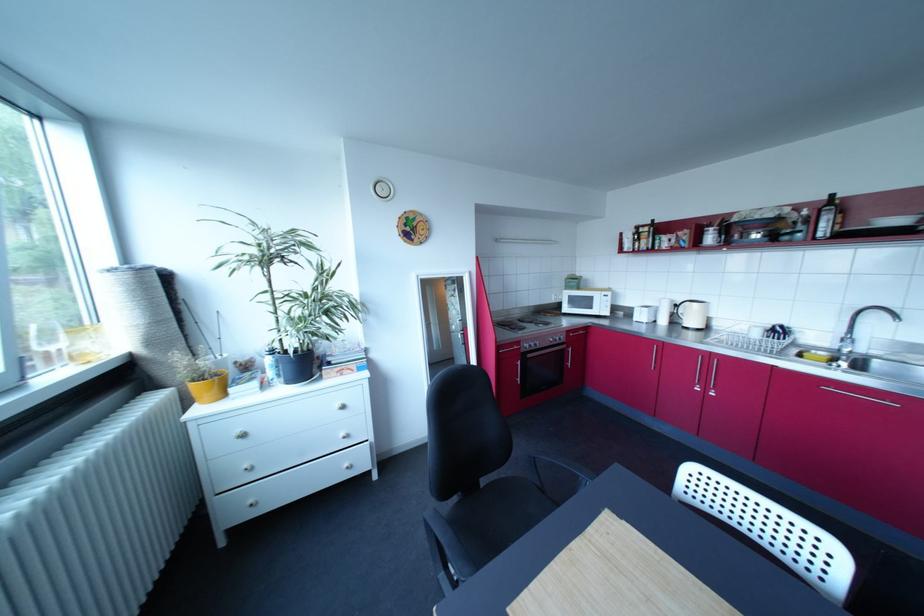
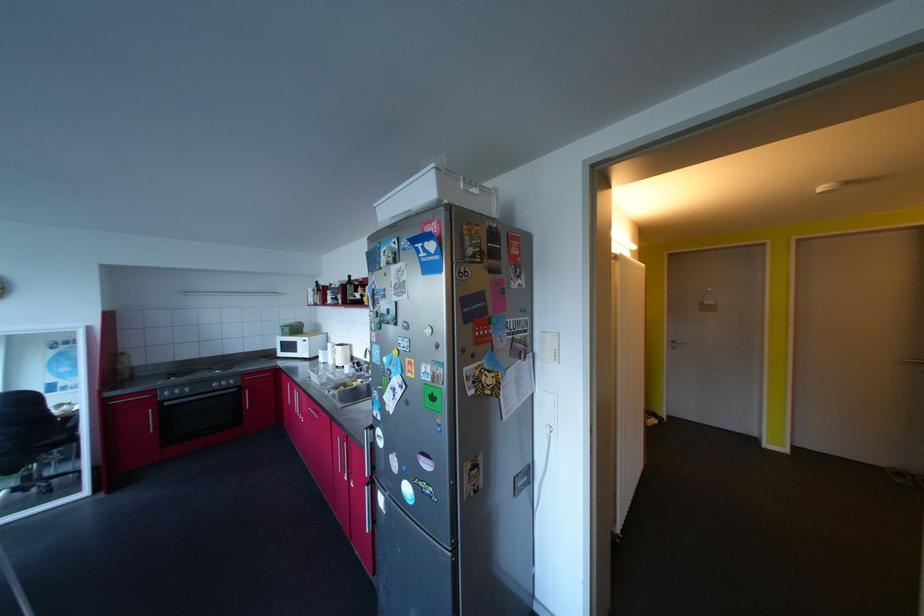
Which direction would the cameraman need to move to produce the second image?

The cameraman moved toward right, backward.